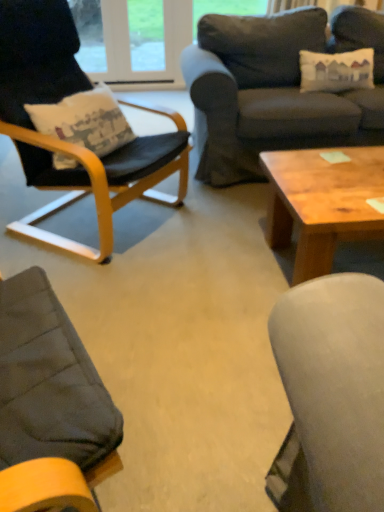
The image size is (384, 512). I want to click on vacant space in black leather chair at left (from a real-world perspective), so click(x=126, y=217).